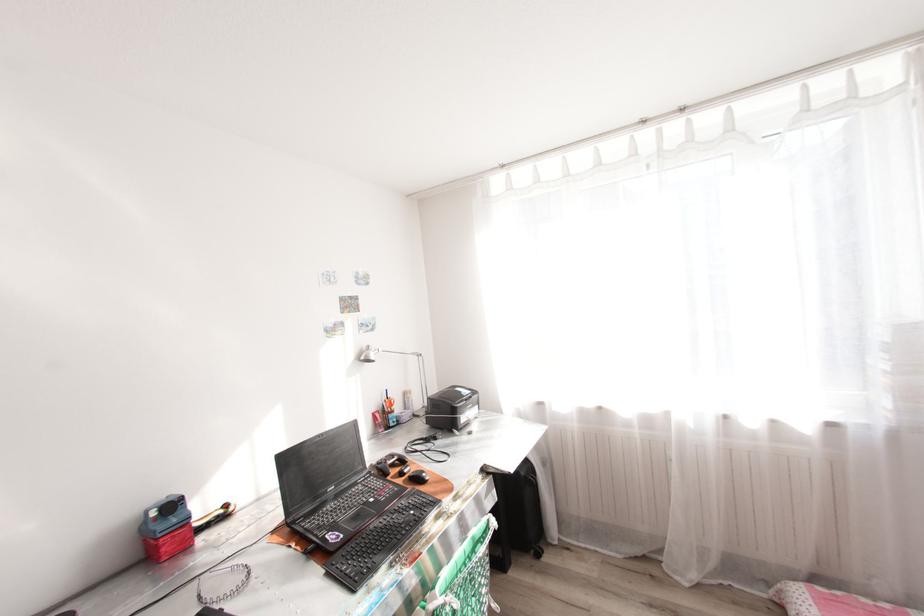
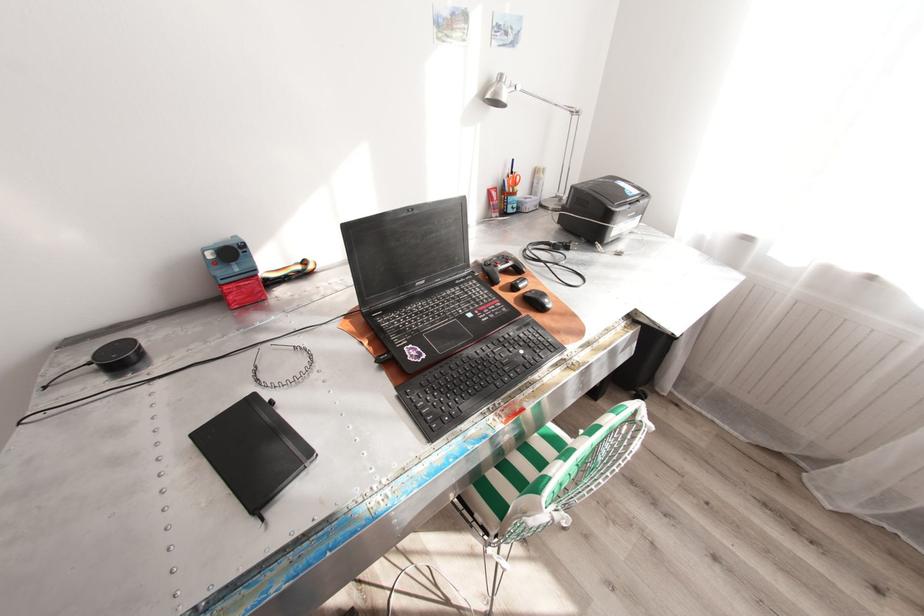
Where in the second image is the point corresponding to [383,464] from the first image?

(490, 264)